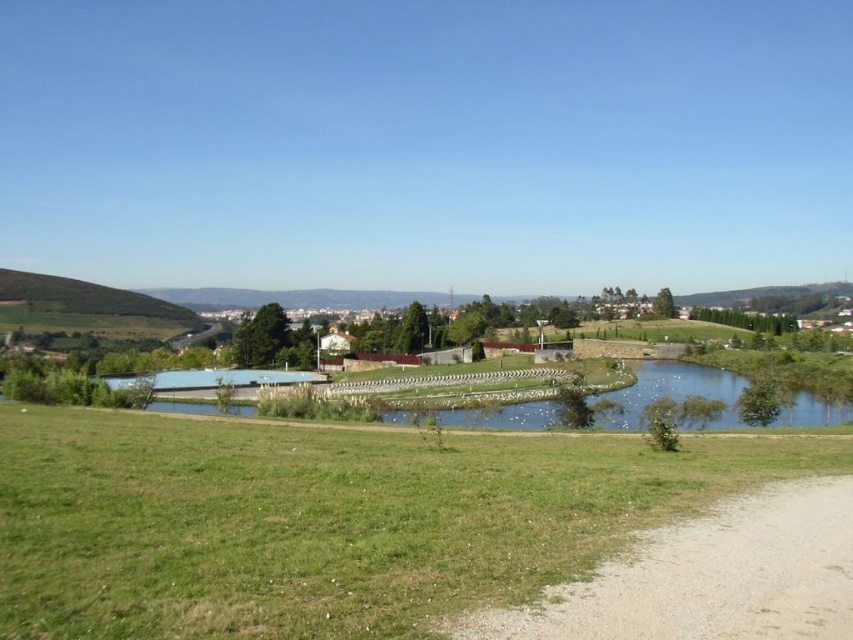
Can you confirm if gravelly dirt path at lower right is smaller than green grassy hill at left?

Indeed, gravelly dirt path at lower right has a smaller size compared to green grassy hill at left.

Who is more forward, (817, 481) or (151, 328)?

Point (817, 481) is more forward.

Locate an element on the screen. The width and height of the screenshot is (853, 640). gravelly dirt path at lower right is located at coordinates (711, 577).

Does green grassy field at lower center have a smaller size compared to gravelly dirt path at lower right?

Actually, green grassy field at lower center might be larger than gravelly dirt path at lower right.

Does green grassy field at lower center have a greater width compared to gravelly dirt path at lower right?

Yes, green grassy field at lower center is wider than gravelly dirt path at lower right.

Does point (567, 564) come farther from viewer compared to point (641, 556)?

No, it is not.

The width and height of the screenshot is (853, 640). In order to click on green grassy field at lower center in this screenshot , I will do `click(323, 522)`.

Is green grassy field at lower center above green grassy hill at left?

Incorrect, green grassy field at lower center is not positioned above green grassy hill at left.

Does green grassy field at lower center have a larger size compared to green grassy hill at left?

No.

What do you see at coordinates (323, 522) in the screenshot? This screenshot has width=853, height=640. I see `green grassy field at lower center` at bounding box center [323, 522].

Find the location of a particular element. The image size is (853, 640). green grassy field at lower center is located at coordinates (323, 522).